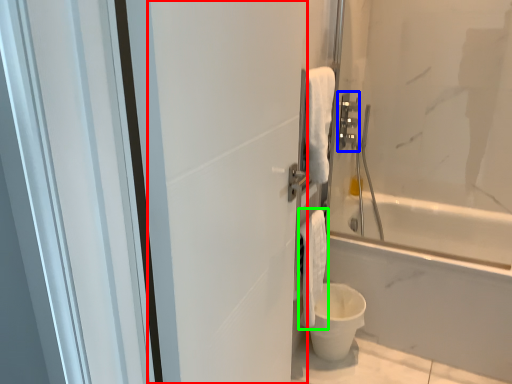
Question: Which object is positioned closest to screen door (highlighted by a red box)? Select from towel bar (highlighted by a blue box) and bath towel (highlighted by a green box).

Choices:
 (A) towel bar
 (B) bath towel

Answer: (B)